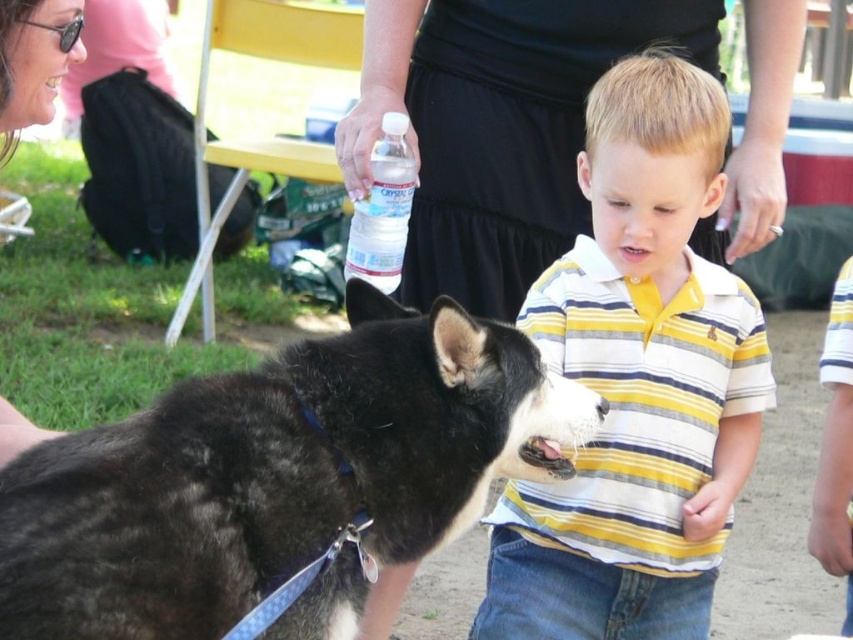
Question: Can you confirm if black fur dog at center is positioned to the left of clear plastic water bottle at center?

Choices:
 (A) no
 (B) yes

Answer: (B)

Question: Which object is positioned closest to the black fur dog at center?

Choices:
 (A) clear plastic water bottle at center
 (B) matte black nose at upper left
 (C) yellow striped polo shirt at center

Answer: (C)

Question: Does black fur dog at center appear under matte black nose at upper left?

Choices:
 (A) yes
 (B) no

Answer: (A)

Question: Is yellow striped polo shirt at center below matte black nose at upper left?

Choices:
 (A) no
 (B) yes

Answer: (B)

Question: Which is farther from the black fur dog at center?

Choices:
 (A) matte black nose at upper left
 (B) yellow striped polo shirt at center
 (C) clear plastic water bottle at center

Answer: (C)

Question: Which point is closer to the camera taking this photo?

Choices:
 (A) (74, 54)
 (B) (22, 492)
 (C) (386, 218)
 (D) (489, 580)

Answer: (B)